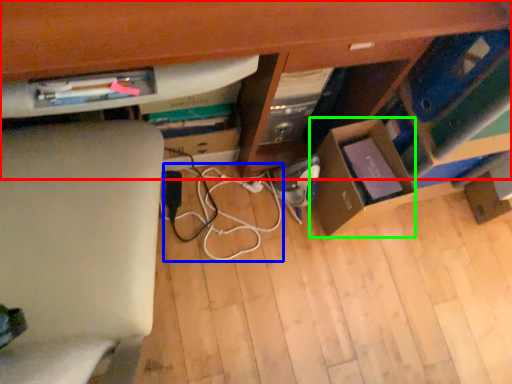
Question: Estimate the real-world distances between objects in this image. Which object is closer to computer desk (highlighted by a red box), string (highlighted by a blue box) or cardboard box (highlighted by a green box)?

Choices:
 (A) string
 (B) cardboard box

Answer: (B)